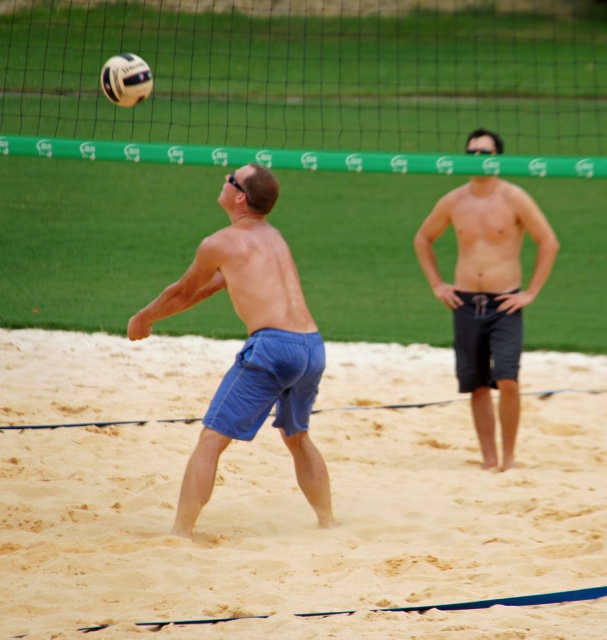
Which is more to the right, dark gray shorts at center or white matte volleyball at upper center?

Positioned to the right is dark gray shorts at center.

Measure the distance between point (441, 221) and camera.

Point (441, 221) is 32.51 feet away from camera.

Where is `dark gray shorts at center`? dark gray shorts at center is located at coordinates (487, 294).

Does fine-grained sand at lower center have a greater height compared to white matte volleyball at upper center?

In fact, fine-grained sand at lower center may be shorter than white matte volleyball at upper center.

Does point (228, 500) come closer to viewer compared to point (129, 93)?

Yes.

The height and width of the screenshot is (640, 607). In order to click on fine-grained sand at lower center in this screenshot , I will do `click(280, 508)`.

Can you confirm if green fabric net at upper center is positioned to the left of white matte volleyball at upper center?

Incorrect, green fabric net at upper center is not on the left side of white matte volleyball at upper center.

Who is more forward, (x=324, y=0) or (x=127, y=102)?

Point (x=127, y=102)

This screenshot has width=607, height=640. I want to click on green fabric net at upper center, so click(311, 83).